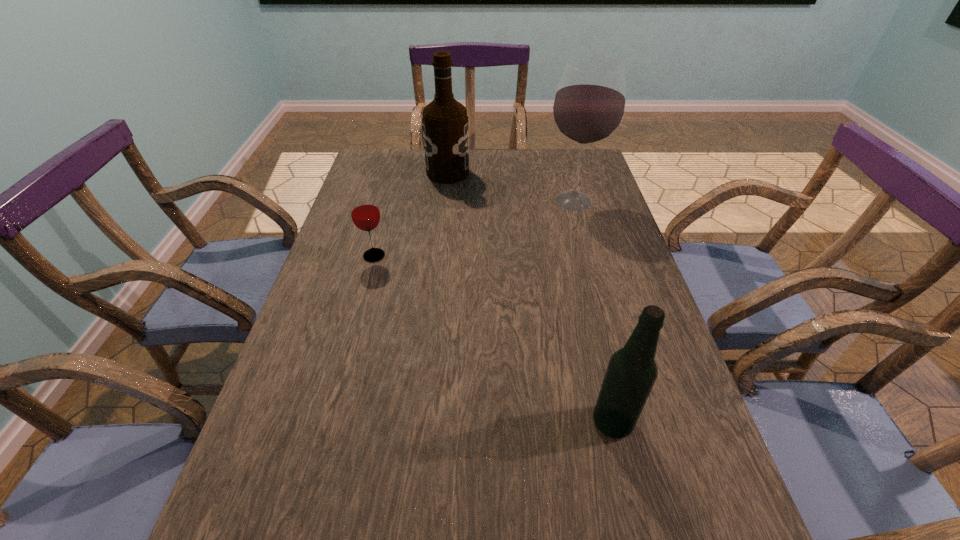
Find the location of a particular element. The width and height of the screenshot is (960, 540). vacant area situated on the left of the second nearest object is located at coordinates (334, 255).

Image resolution: width=960 pixels, height=540 pixels. Find the location of `object that is positioned at the left edge`. object that is positioned at the left edge is located at coordinates (365, 214).

In order to click on object that is positioned at the far right corner in this screenshot , I will do [589, 105].

The width and height of the screenshot is (960, 540). What are the coordinates of `vacant area at the far edge` in the screenshot? It's located at (538, 150).

This screenshot has width=960, height=540. What are the coordinates of `vacant region at the left edge of the desktop` in the screenshot? It's located at (348, 313).

This screenshot has height=540, width=960. In the image, there is a desktop. Find the location of `free space at the right edge`. free space at the right edge is located at coordinates (669, 486).

This screenshot has height=540, width=960. In the image, there is a desktop. In order to click on free space at the far left corner in this screenshot , I will do `click(403, 169)`.

Where is `free location at the far right corner`? The width and height of the screenshot is (960, 540). free location at the far right corner is located at coordinates (559, 172).

The width and height of the screenshot is (960, 540). Find the location of `free space that is in between the shortest alcohol and the leftmost alcohol`. free space that is in between the shortest alcohol and the leftmost alcohol is located at coordinates (530, 298).

Locate an element on the screen. Image resolution: width=960 pixels, height=540 pixels. unoccupied area between the nearest alcohol and the farthest alcohol is located at coordinates (530, 298).